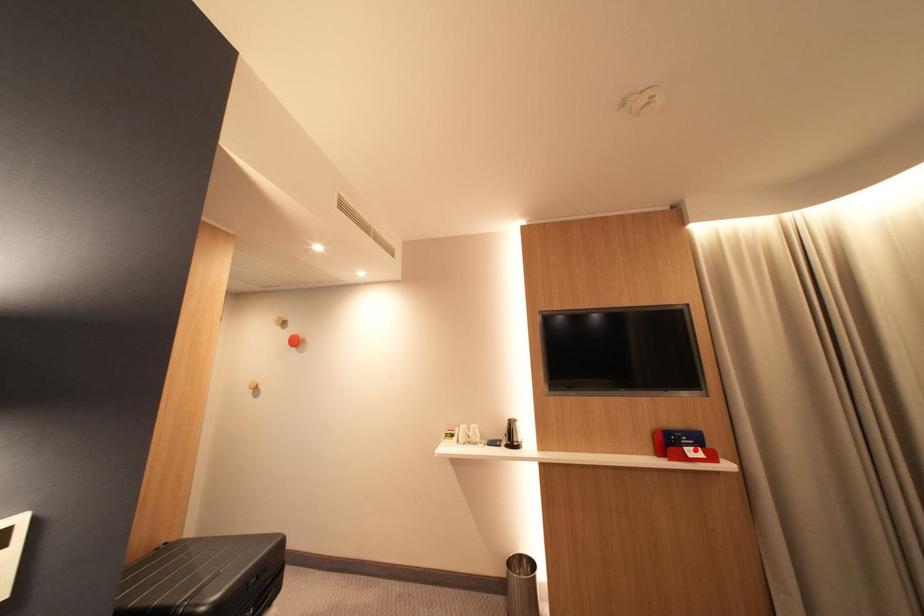
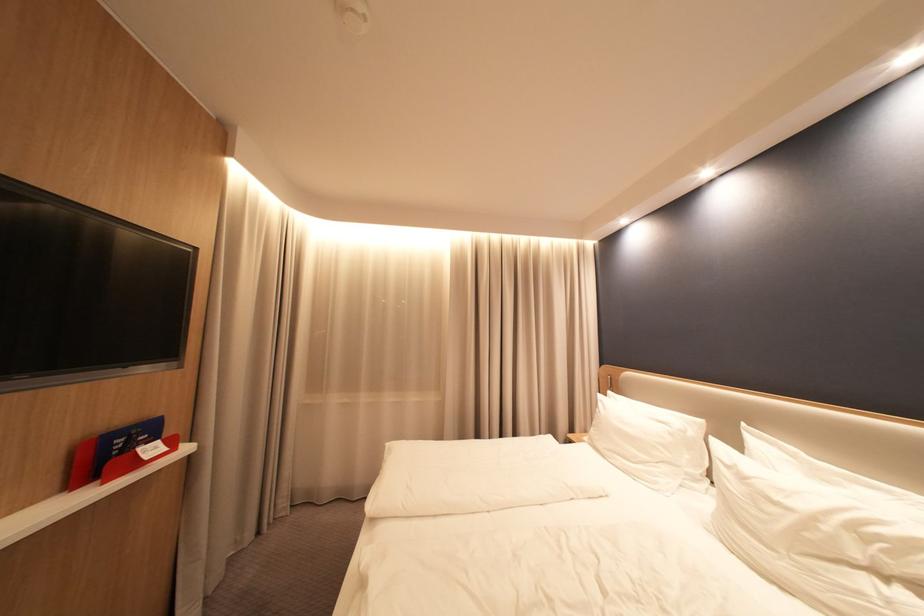
Where in the second image is the point corresponding to the highlighted location from the first image?

(150, 452)